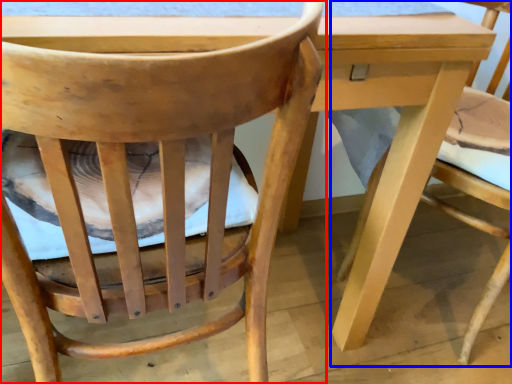
Question: Which point is closer to the camera, chair (highlighted by a red box) or chair (highlighted by a blue box)?

Choices:
 (A) chair
 (B) chair

Answer: (A)